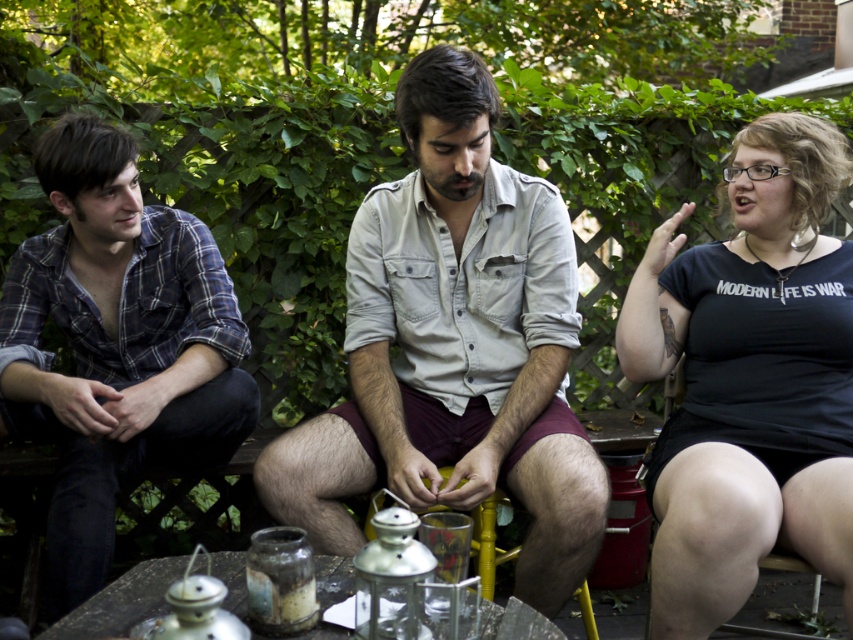
Question: Which of the following is the closest to the observer?

Choices:
 (A) plaid cotton shirt at left
 (B) metallic glass table at center
 (C) black matte shirt at right

Answer: (B)

Question: Can you confirm if black matte shirt at right is bigger than plaid cotton shirt at left?

Choices:
 (A) yes
 (B) no

Answer: (B)

Question: Which point is closer to the camera taking this photo?

Choices:
 (A) click(424, 138)
 (B) click(695, 596)

Answer: (B)

Question: Does plaid cotton shirt at left have a smaller size compared to metallic glass table at center?

Choices:
 (A) yes
 (B) no

Answer: (B)

Question: Is light gray cotton shirt at center in front of black matte shirt at right?

Choices:
 (A) yes
 (B) no

Answer: (B)

Question: Which point is farther from the camera taking this photo?

Choices:
 (A) (112, 273)
 (B) (705, 324)

Answer: (A)